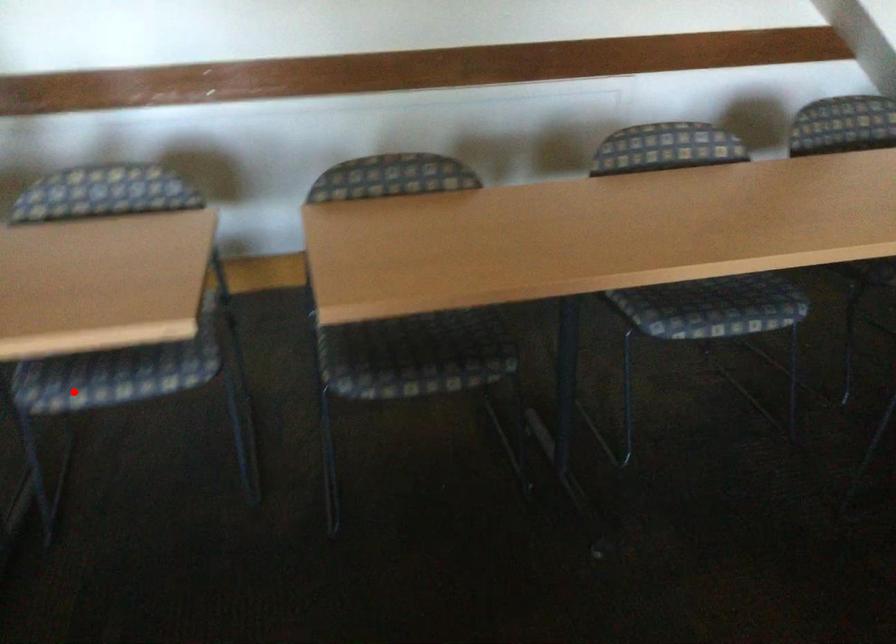
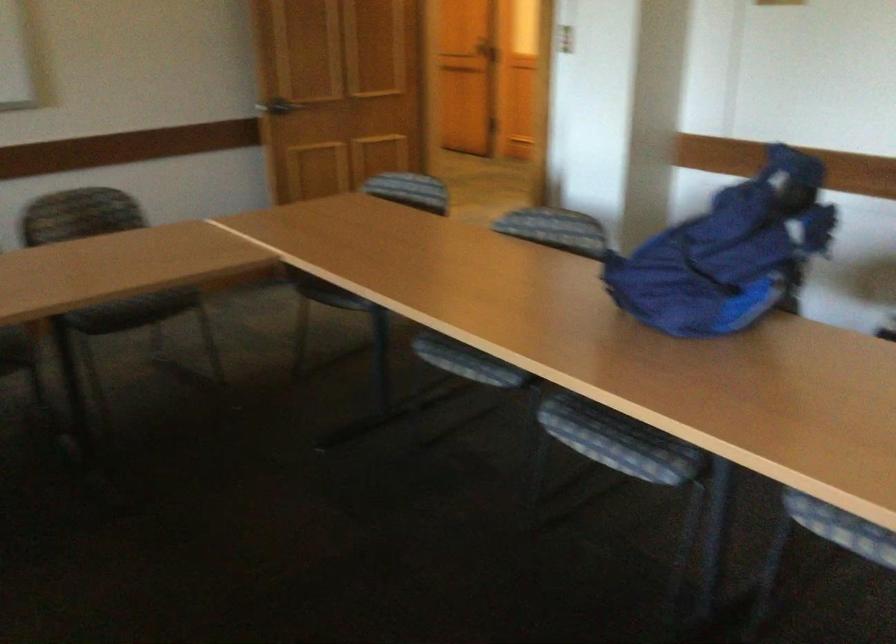
Question: I am providing you with two images of the same scene from different viewpoints. A red point is marked on the first image. At the location where the point appears in image 1, is it still visible in image 2?

Choices:
 (A) Yes
 (B) No

Answer: (A)